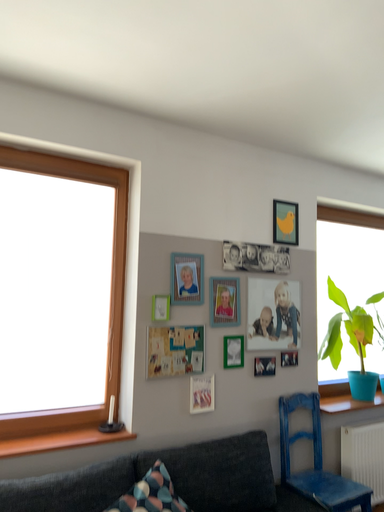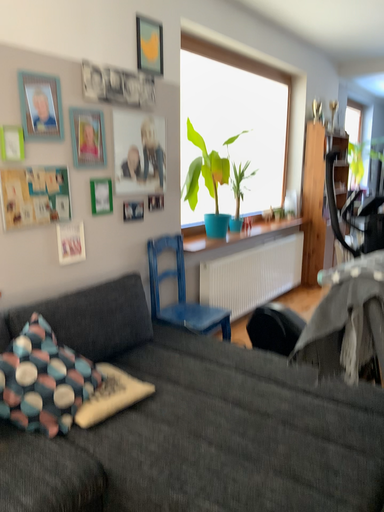
Question: Which way did the camera rotate in the video?

Choices:
 (A) rotated left
 (B) rotated right

Answer: (B)